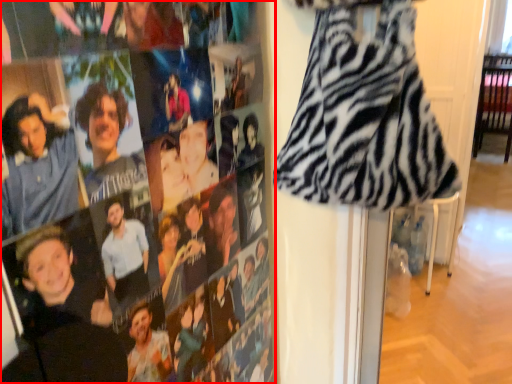
Question: In this image, where is person (annotated by the red box) located relative to fancy dress?

Choices:
 (A) left
 (B) right

Answer: (A)